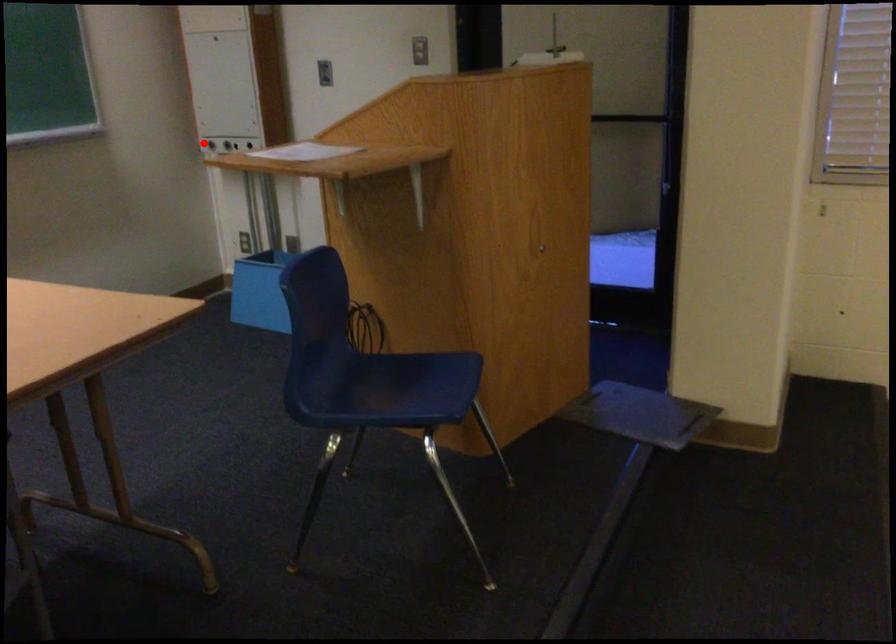
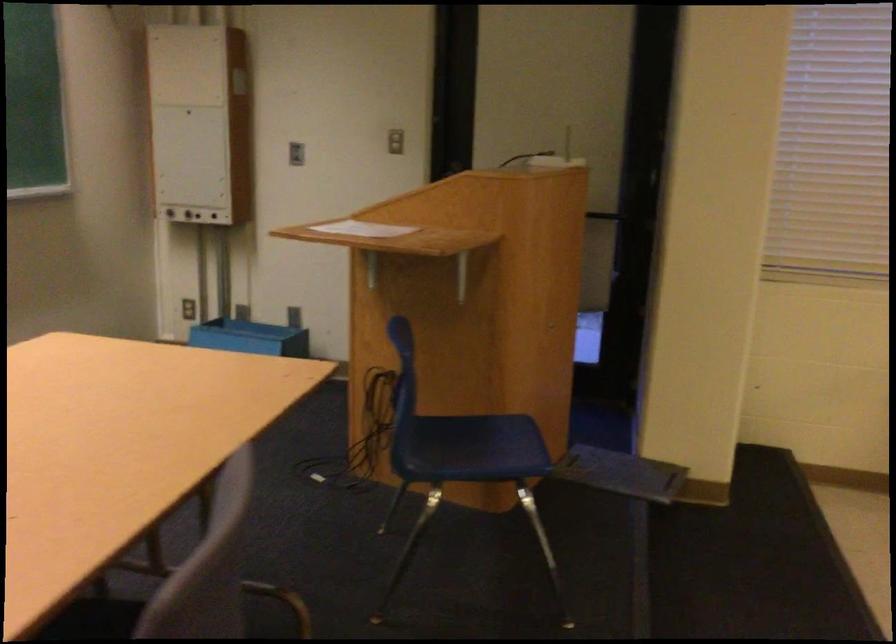
Locate, in the second image, the point that corresponds to the highlighted location in the first image.

(167, 210)